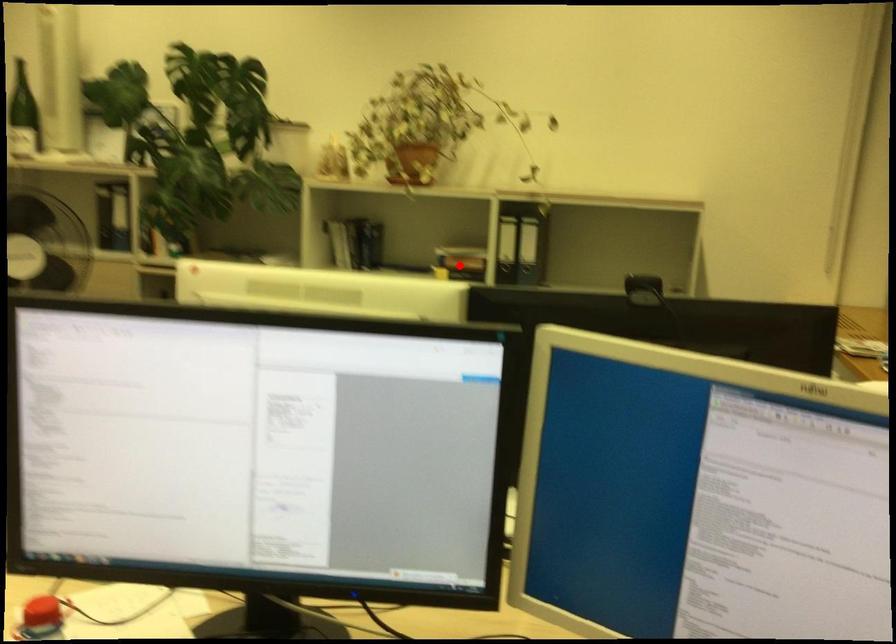
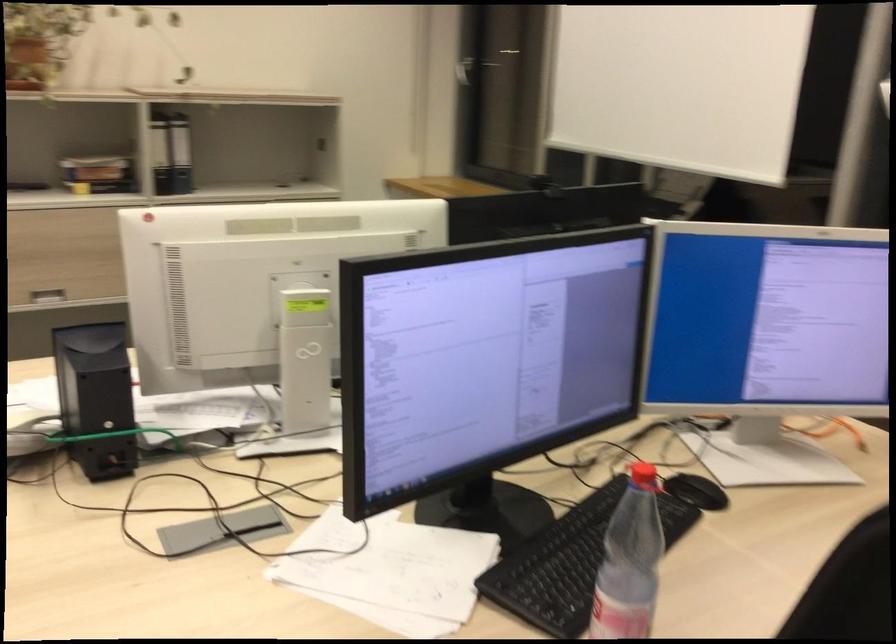
Find the pixel in the second image that matches the highlighted location in the first image.

(105, 175)